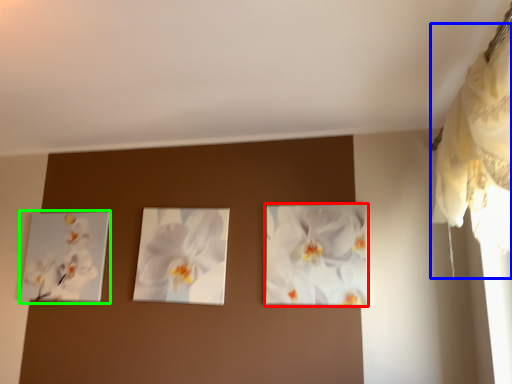
Question: Which object is positioned farthest from flower (highlighted by a red box)? Select from curtain (highlighted by a blue box) and picture frame (highlighted by a green box).

Choices:
 (A) curtain
 (B) picture frame

Answer: (B)